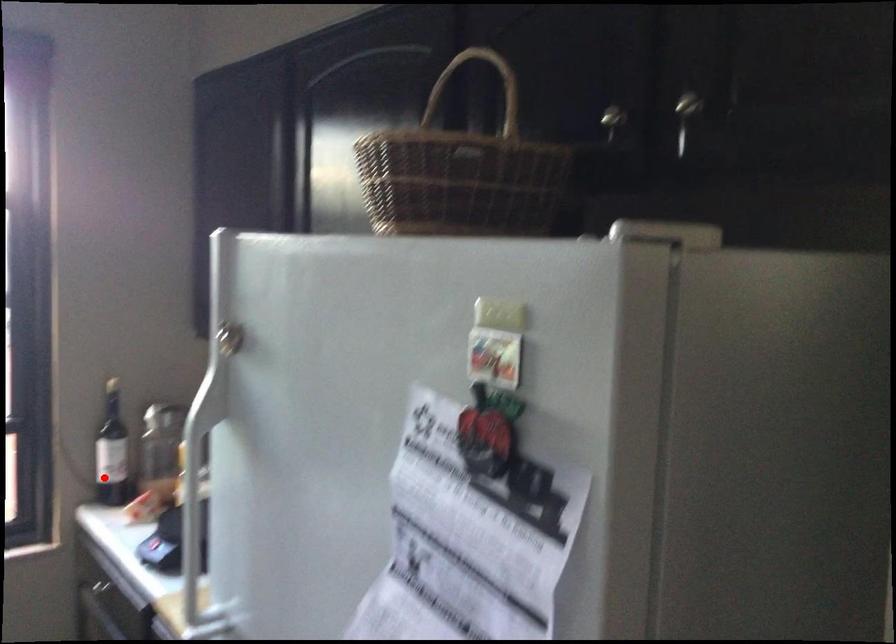
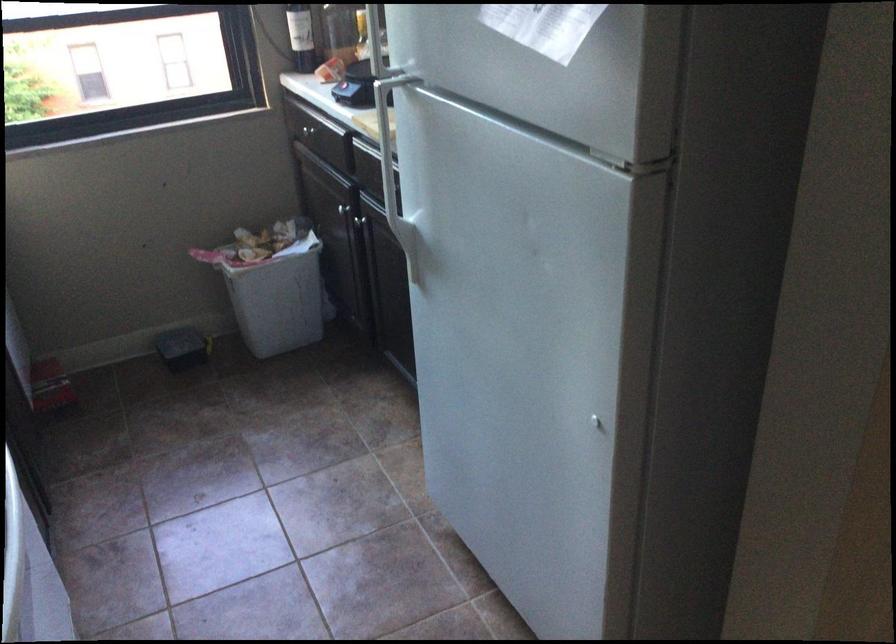
Question: I am providing you with two images of the same scene from different viewpoints. A red point is shown in image1. For the corresponding object point in image2, is it positioned nearer or farther from the camera?

Choices:
 (A) Nearer
 (B) Farther

Answer: (B)